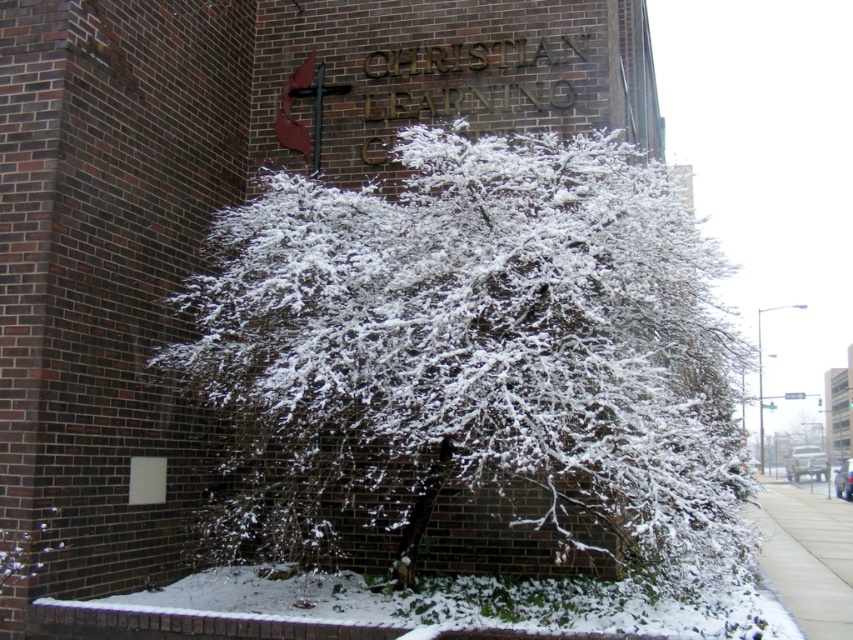
Question: Is white snow-covered tree at center above concrete sidewalk at lower right?

Choices:
 (A) yes
 (B) no

Answer: (A)

Question: Can you confirm if white snow-covered tree at center is thinner than concrete sidewalk at lower right?

Choices:
 (A) yes
 (B) no

Answer: (A)

Question: Observing the image, what is the correct spatial positioning of white snow-covered tree at center in reference to concrete sidewalk at lower right?

Choices:
 (A) left
 (B) right

Answer: (A)

Question: Which point is closer to the camera taking this photo?

Choices:
 (A) (793, 608)
 (B) (670, 371)

Answer: (B)